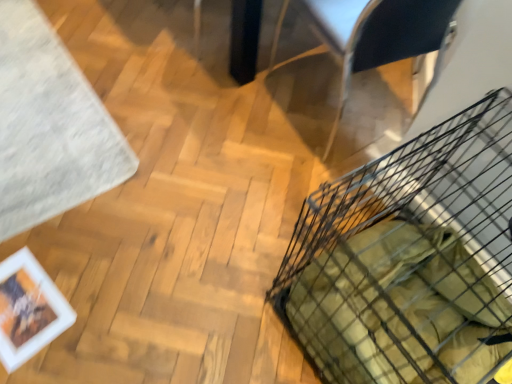
Question: Is white soft rug at upper left touching black wire basket at lower right?

Choices:
 (A) yes
 (B) no

Answer: (B)

Question: Is white soft rug at upper left looking in the opposite direction of black wire basket at lower right?

Choices:
 (A) no
 (B) yes

Answer: (A)

Question: Is the depth of white soft rug at upper left less than that of black wire basket at lower right?

Choices:
 (A) yes
 (B) no

Answer: (B)

Question: From the image's perspective, is white soft rug at upper left above black wire basket at lower right?

Choices:
 (A) yes
 (B) no

Answer: (A)

Question: Could you tell me if white soft rug at upper left is facing black wire basket at lower right?

Choices:
 (A) yes
 (B) no

Answer: (B)

Question: Is white soft rug at upper left wider than black wire basket at lower right?

Choices:
 (A) yes
 (B) no

Answer: (B)

Question: Does metallic silver armchair at upper right appear on the right side of white matte picture frame at lower left?

Choices:
 (A) yes
 (B) no

Answer: (A)

Question: Could you tell me if metallic silver armchair at upper right is facing white matte picture frame at lower left?

Choices:
 (A) yes
 (B) no

Answer: (B)

Question: Does metallic silver armchair at upper right have a smaller size compared to white matte picture frame at lower left?

Choices:
 (A) no
 (B) yes

Answer: (A)

Question: Can you see metallic silver armchair at upper right touching white matte picture frame at lower left?

Choices:
 (A) no
 (B) yes

Answer: (A)

Question: Is metallic silver armchair at upper right looking in the opposite direction of white matte picture frame at lower left?

Choices:
 (A) no
 (B) yes

Answer: (A)

Question: Is metallic silver armchair at upper right far away from white matte picture frame at lower left?

Choices:
 (A) no
 (B) yes

Answer: (B)

Question: Can you confirm if metallic silver armchair at upper right is shorter than black wire basket at lower right?

Choices:
 (A) no
 (B) yes

Answer: (A)